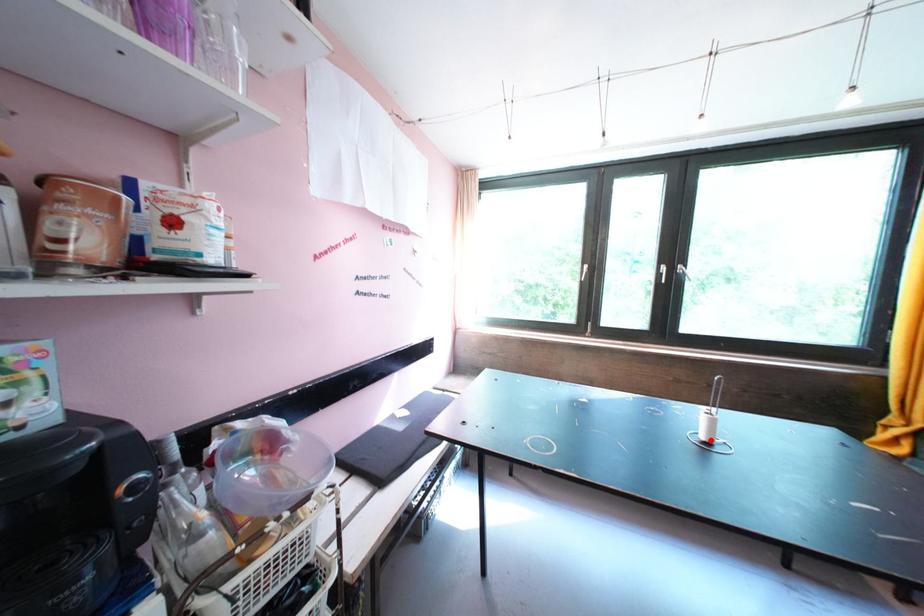
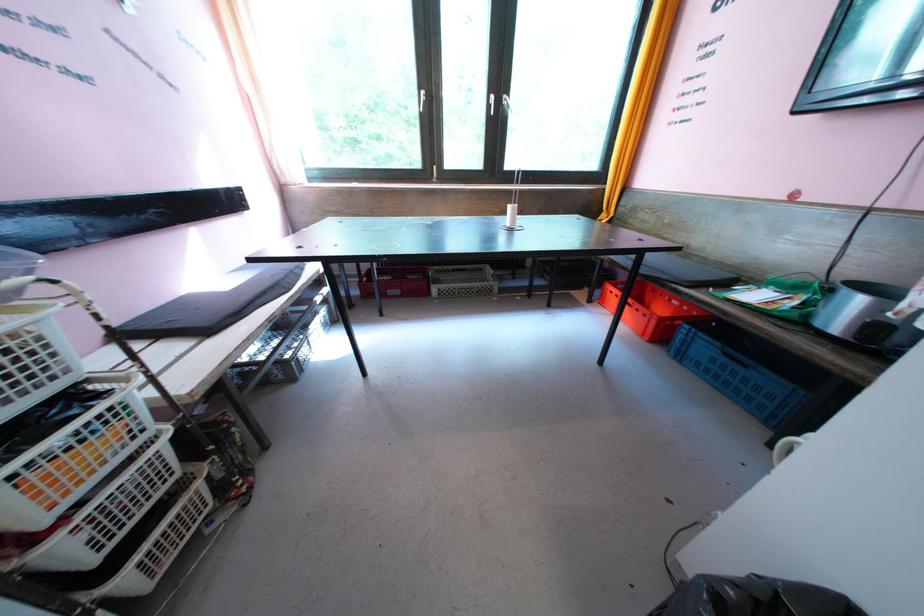
Where in the second image is the point corresponding to the highlighted location from the first image?

(517, 227)